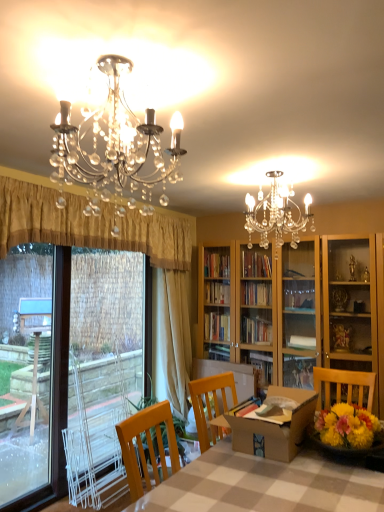
The height and width of the screenshot is (512, 384). Identify the location of vacant space in front of brown cardboard box at center. (306, 485).